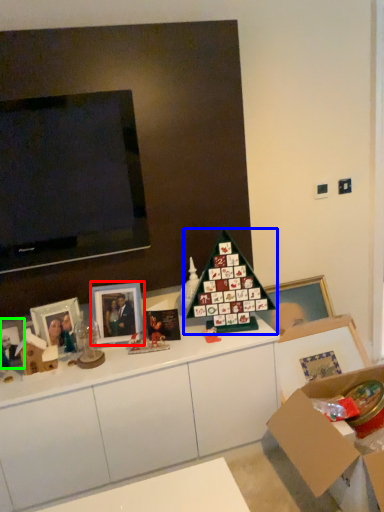
Question: Which object is positioned closest to picture frame (highlighted by a red box)? Select from christmas tree (highlighted by a blue box) and picture frame (highlighted by a green box).

Choices:
 (A) christmas tree
 (B) picture frame

Answer: (A)